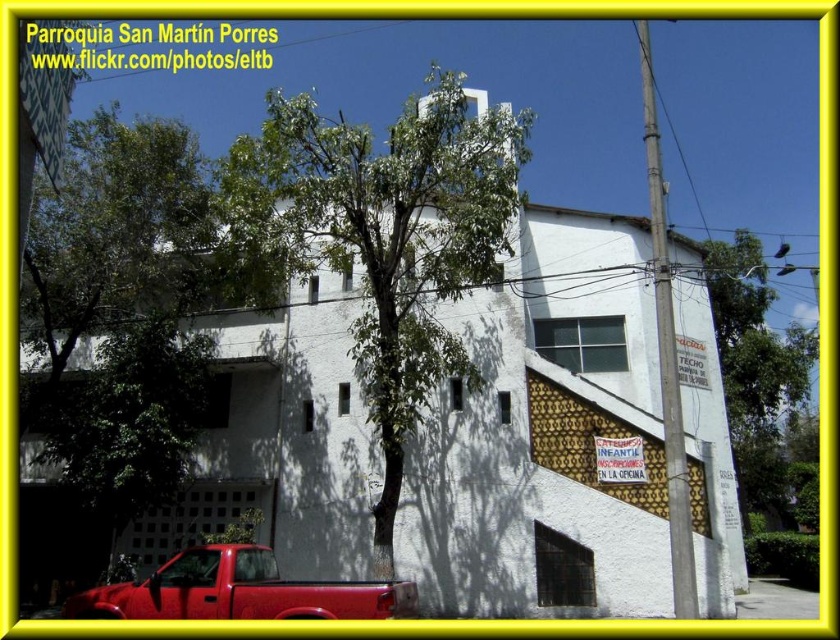
Question: Is green leafy tree at center bigger than green leafy tree at right?

Choices:
 (A) yes
 (B) no

Answer: (A)

Question: Which point appears farthest from the camera in this image?

Choices:
 (A) click(799, 346)
 (B) click(379, 276)

Answer: (A)

Question: Based on their relative distances, which object is nearer to the green leafy tree at center?

Choices:
 (A) shiny red truck at lower left
 (B) green leafy tree at right

Answer: (A)

Question: Does green leafy tree at right appear under shiny red truck at lower left?

Choices:
 (A) no
 (B) yes

Answer: (A)

Question: Which point is closer to the camera?

Choices:
 (A) (361, 340)
 (B) (218, 580)
 (C) (783, 368)

Answer: (B)

Question: Can you confirm if green leafy tree at right is thinner than shiny red truck at lower left?

Choices:
 (A) no
 (B) yes

Answer: (A)